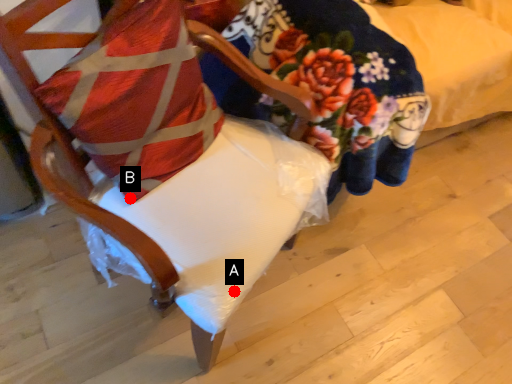
Question: Two points are circled on the image, labeled by A and B beside each circle. Which point is closer to the camera?

Choices:
 (A) A is closer
 (B) B is closer

Answer: (A)